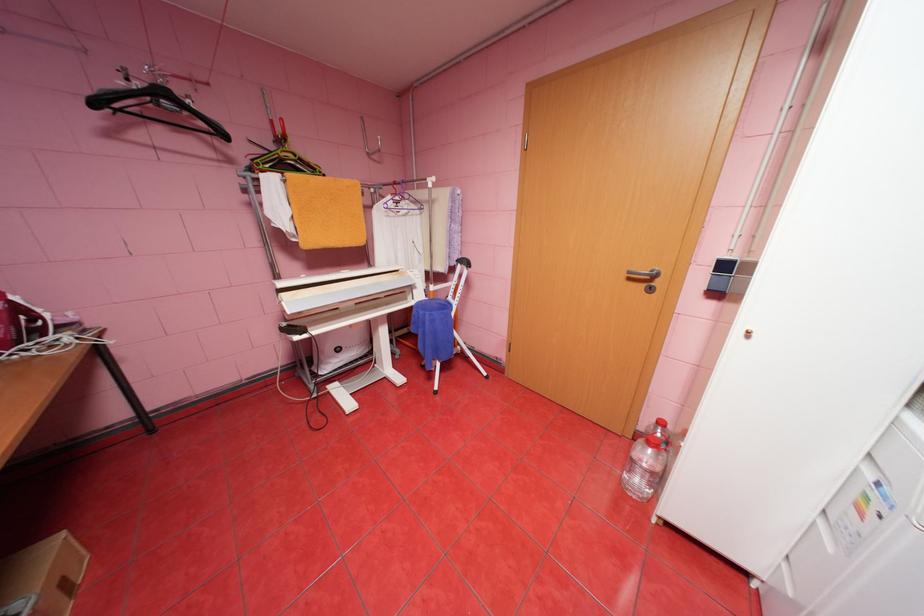
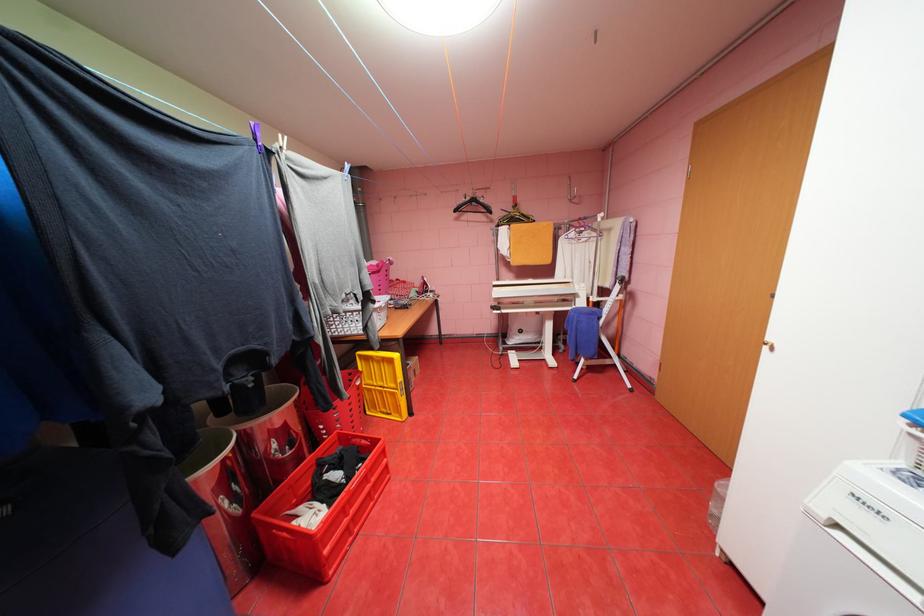
Locate, in the second image, the point that corresponds to [238,160] in the first image.

(500, 221)